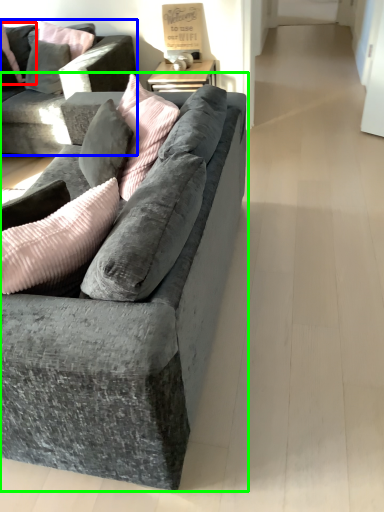
Question: Which object is positioned farthest from pillow (highlighted by a red box)? Select from studio couch (highlighted by a blue box) and studio couch (highlighted by a green box).

Choices:
 (A) studio couch
 (B) studio couch

Answer: (B)